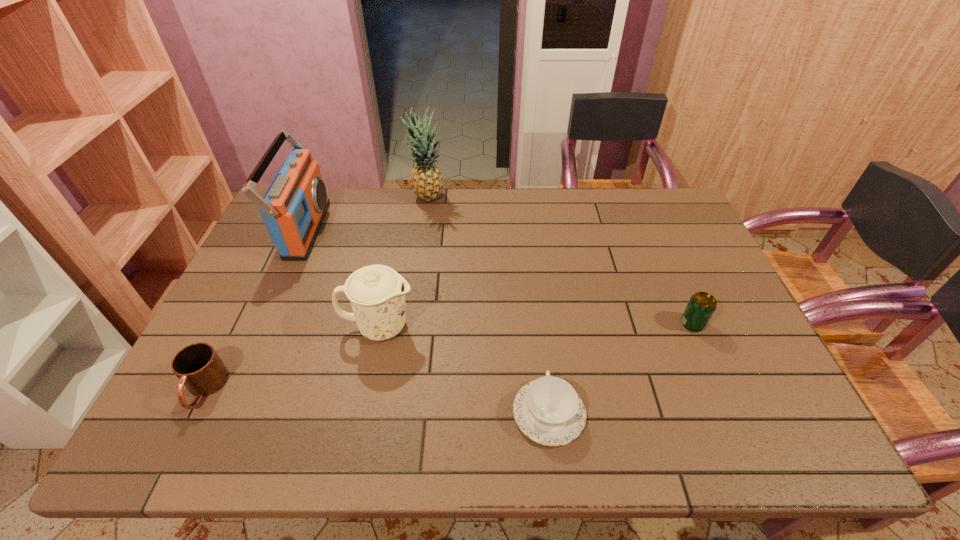
Where is `free space located on the spout of the third tallest object`? free space located on the spout of the third tallest object is located at coordinates (535, 327).

Where is `vacant space located 0.400m on the left of the beer can`? The height and width of the screenshot is (540, 960). vacant space located 0.400m on the left of the beer can is located at coordinates (529, 324).

I want to click on vacant region located on the side of the mug with the handle, so click(179, 442).

Image resolution: width=960 pixels, height=540 pixels. I want to click on free spot located on the handle side of the second object from right to left, so click(x=540, y=332).

This screenshot has width=960, height=540. In order to click on blank area located on the handle side of the second object from right to left in this screenshot , I will do `click(539, 323)`.

Locate an element on the screen. This screenshot has width=960, height=540. vacant point located on the handle side of the second object from right to left is located at coordinates (540, 338).

This screenshot has width=960, height=540. I want to click on pineapple positioned at the far edge, so click(x=427, y=182).

What are the coordinates of `radio receiver that is at the far edge` in the screenshot? It's located at (293, 208).

Identify the location of mug that is at the near edge. (199, 368).

Where is `chinaware positioned at the near edge`? This screenshot has width=960, height=540. chinaware positioned at the near edge is located at coordinates (548, 410).